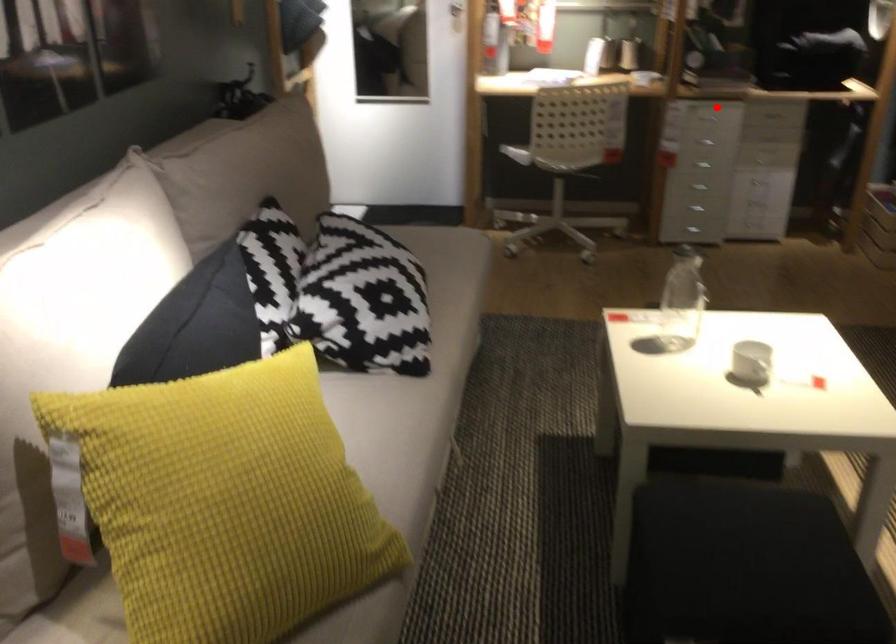
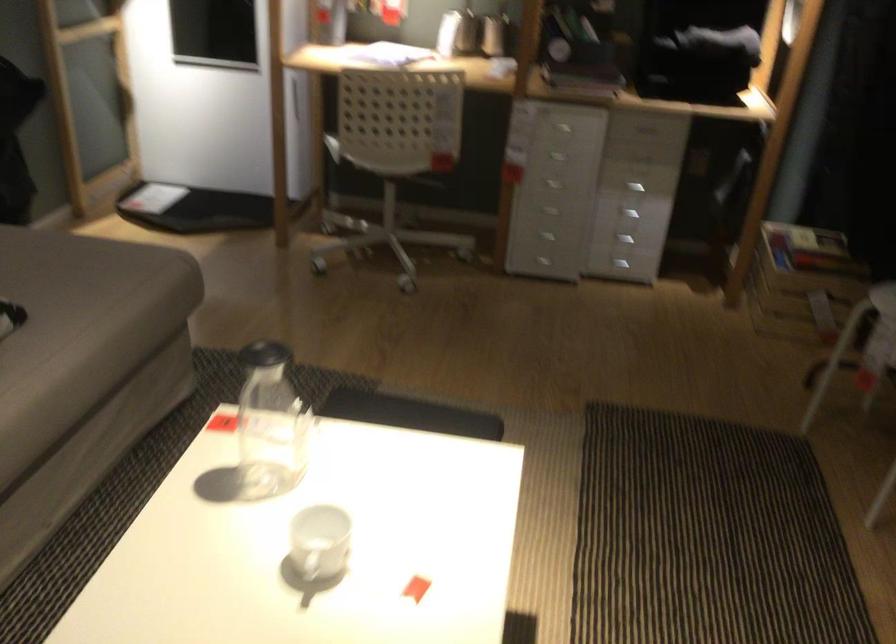
Where in the second image is the point corresponding to the highlighted location from the first image?

(563, 128)